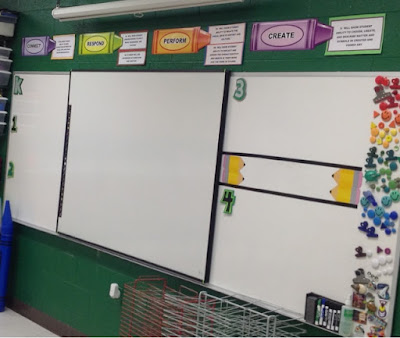
I want to click on marker, so click(318, 314), click(320, 314), click(323, 314), click(327, 317), click(332, 317), click(337, 317).